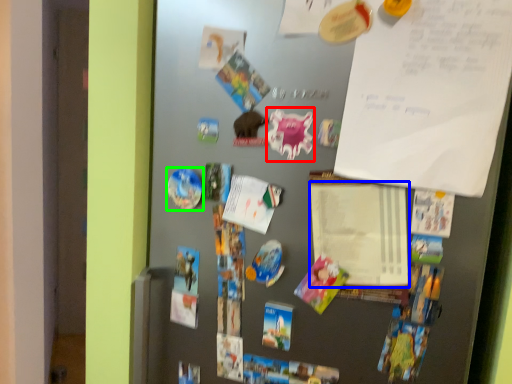
Question: Based on their relative distances, which object is nearer to art (highlighted by a red box)? Choose from notepad (highlighted by a blue box) and art (highlighted by a green box).

Choices:
 (A) notepad
 (B) art

Answer: (A)